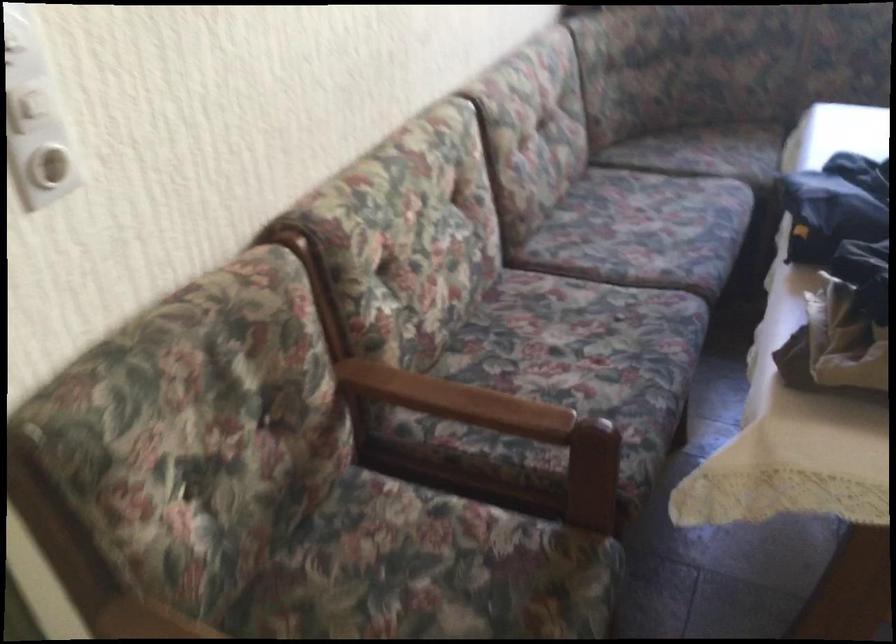
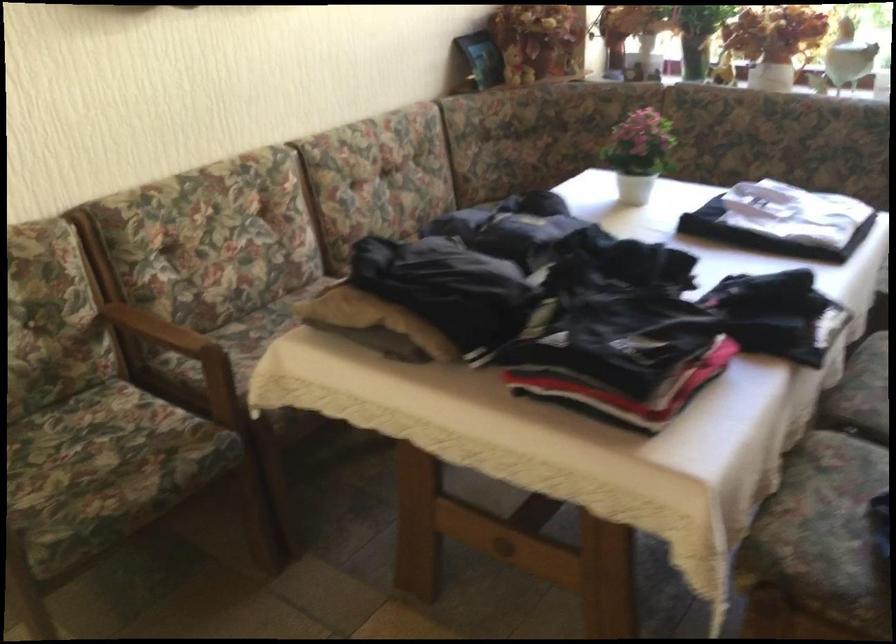
In the second image, find the point that corresponds to pixel 490 350 in the first image.

(263, 324)